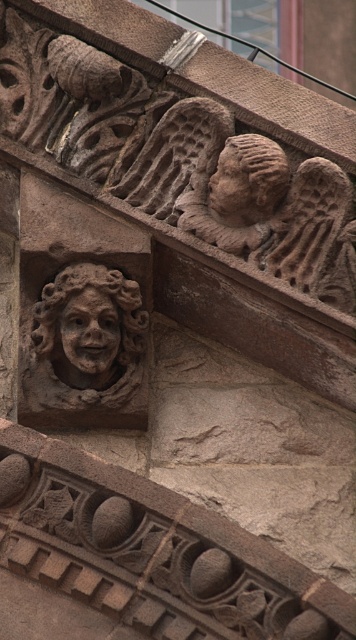
Question: Can you confirm if matte stone face at center is thinner than matte stone face at upper center?

Choices:
 (A) no
 (B) yes

Answer: (A)

Question: Can you confirm if brown stone face at center is positioned to the left of matte stone face at center?

Choices:
 (A) no
 (B) yes

Answer: (B)

Question: Considering the real-world distances, which object is closest to the matte stone face at center?

Choices:
 (A) brown stone head at upper center
 (B) brown stone face at center

Answer: (B)

Question: Which point is closer to the camera?

Choices:
 (A) (107, 320)
 (B) (270, 152)
 (C) (54, 376)

Answer: (B)

Question: Estimate the real-world distances between objects in this image. Which object is farther from the matte stone face at upper center?

Choices:
 (A) brown stone head at upper center
 (B) matte stone face at center

Answer: (B)

Question: Can you confirm if brown stone head at upper center is positioned to the left of matte stone face at upper center?

Choices:
 (A) no
 (B) yes

Answer: (A)